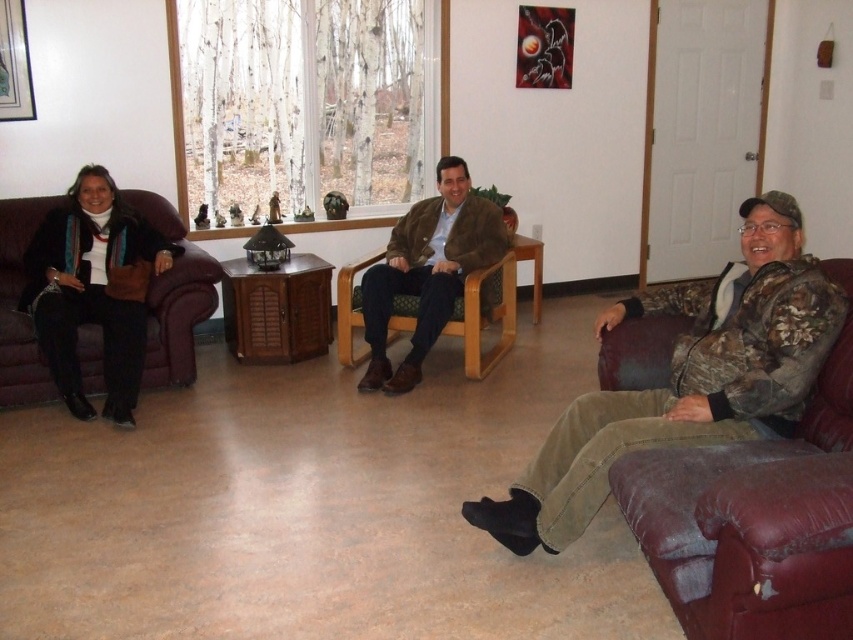
Question: Among these objects, which one is nearest to the camera?

Choices:
 (A) leather couch at right
 (B) leather couch at left
 (C) brown suede jacket at center

Answer: (A)

Question: Is camouflage jacket at right positioned before leather couch at left?

Choices:
 (A) no
 (B) yes

Answer: (B)

Question: Which point appears farthest from the camera in this image?

Choices:
 (A) (492, 508)
 (B) (683, 509)

Answer: (A)

Question: Can you confirm if leather couch at right is positioned to the right of brown suede jacket at center?

Choices:
 (A) yes
 (B) no

Answer: (A)

Question: Is leather couch at left smaller than brushed metal picture frame at upper left?

Choices:
 (A) no
 (B) yes

Answer: (A)

Question: Which object is the closest to the brushed metal picture frame at upper left?

Choices:
 (A) leather couch at right
 (B) camouflage jacket at right
 (C) brown suede jacket at center
 (D) leather couch at left

Answer: (D)